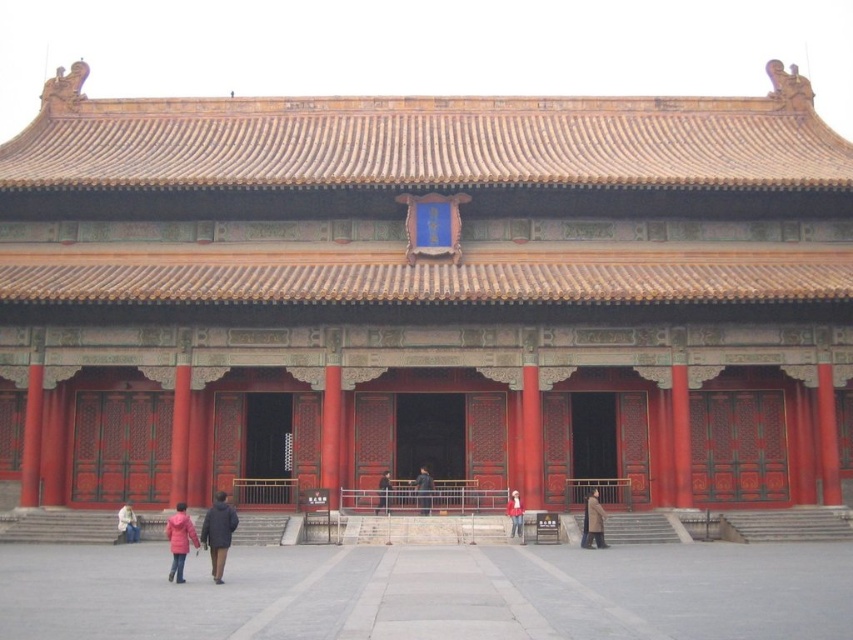
Question: Which point is closer to the camera taking this photo?

Choices:
 (A) (517, 509)
 (B) (418, 506)
 (C) (378, 506)
 (D) (123, 518)

Answer: (D)

Question: Does pink fabric coat at lower center have a larger size compared to black leather jacket at center?

Choices:
 (A) no
 (B) yes

Answer: (B)

Question: Which object appears closest to the camera in this image?

Choices:
 (A) brown wool coat at center
 (B) dark brown coat at lower center
 (C) red fabric jacket at center
 (D) dark gray fabric coat at center

Answer: (B)

Question: Does white matte jacket at lower left appear over black leather jacket at center?

Choices:
 (A) no
 (B) yes

Answer: (A)

Question: Does dark brown coat at lower center appear on the right side of brown wool coat at center?

Choices:
 (A) yes
 (B) no

Answer: (B)

Question: Which object is farther from the camera taking this photo?

Choices:
 (A) white matte jacket at lower left
 (B) black leather jacket at center
 (C) dark brown coat at lower center
 (D) brown wool coat at center

Answer: (B)